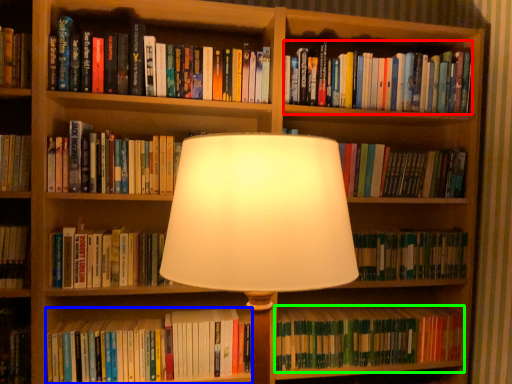
Question: Which is nearer to the book (highlighted by a red box)? book (highlighted by a blue box) or book (highlighted by a green box).

Choices:
 (A) book
 (B) book

Answer: (B)